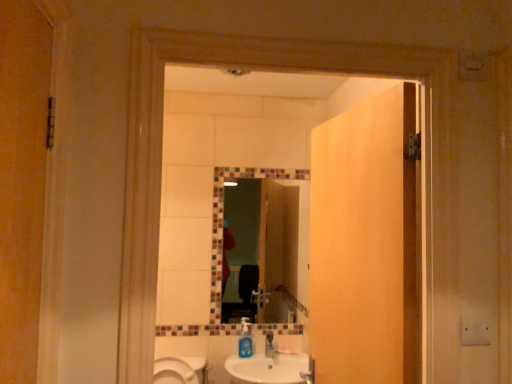
Question: Is matte wood door at center to the right of white glossy sink at lower center from the viewer's perspective?

Choices:
 (A) yes
 (B) no

Answer: (A)

Question: Is matte wood door at center completely or partially outside of white glossy sink at lower center?

Choices:
 (A) yes
 (B) no

Answer: (A)

Question: From the image's perspective, is matte wood door at center located beneath white glossy sink at lower center?

Choices:
 (A) yes
 (B) no

Answer: (B)

Question: Is white glossy sink at lower center located within matte wood door at center?

Choices:
 (A) no
 (B) yes

Answer: (A)

Question: Could you tell me if matte wood door at center is turned towards white glossy sink at lower center?

Choices:
 (A) no
 (B) yes

Answer: (A)

Question: Would you say matte wood door at center is to the left or to the right of multicolored mosaic mirror at center in the picture?

Choices:
 (A) left
 (B) right

Answer: (B)

Question: Considering the positions of matte wood door at center and multicolored mosaic mirror at center in the image, is matte wood door at center taller or shorter than multicolored mosaic mirror at center?

Choices:
 (A) tall
 (B) short

Answer: (A)

Question: From a real-world perspective, relative to multicolored mosaic mirror at center, is matte wood door at center vertically above or below?

Choices:
 (A) below
 (B) above

Answer: (B)

Question: Is matte wood door at center inside or outside of multicolored mosaic mirror at center?

Choices:
 (A) outside
 (B) inside

Answer: (A)

Question: In the image, is white glossy sink at lower center positioned in front of or behind matte wood door at center?

Choices:
 (A) behind
 (B) front

Answer: (A)

Question: Is white glossy sink at lower center to the left or to the right of matte wood door at center in the image?

Choices:
 (A) right
 (B) left

Answer: (B)

Question: In terms of size, does white glossy sink at lower center appear bigger or smaller than matte wood door at center?

Choices:
 (A) small
 (B) big

Answer: (A)

Question: From a real-world perspective, is white glossy sink at lower center positioned above or below matte wood door at center?

Choices:
 (A) below
 (B) above

Answer: (A)

Question: Is matte wood door at center bigger or smaller than white glossy sink at lower center?

Choices:
 (A) big
 (B) small

Answer: (A)

Question: From a real-world perspective, is matte wood door at center positioned above or below white glossy sink at lower center?

Choices:
 (A) below
 (B) above

Answer: (B)